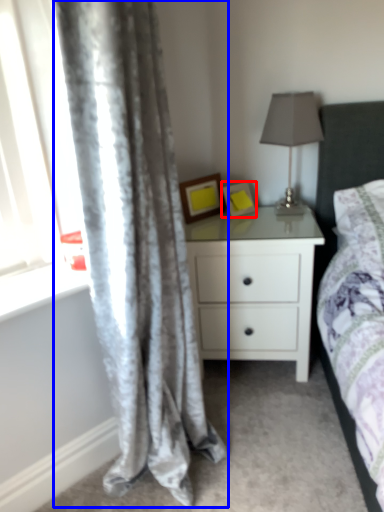
Question: Which point is closer to the camera, picture frame (highlighted by a red box) or curtain (highlighted by a blue box)?

Choices:
 (A) picture frame
 (B) curtain

Answer: (B)